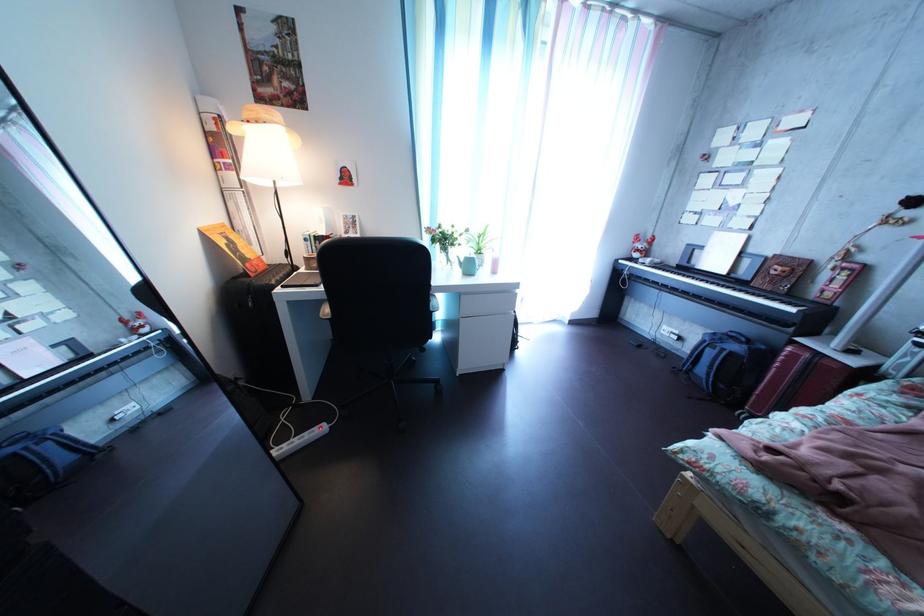
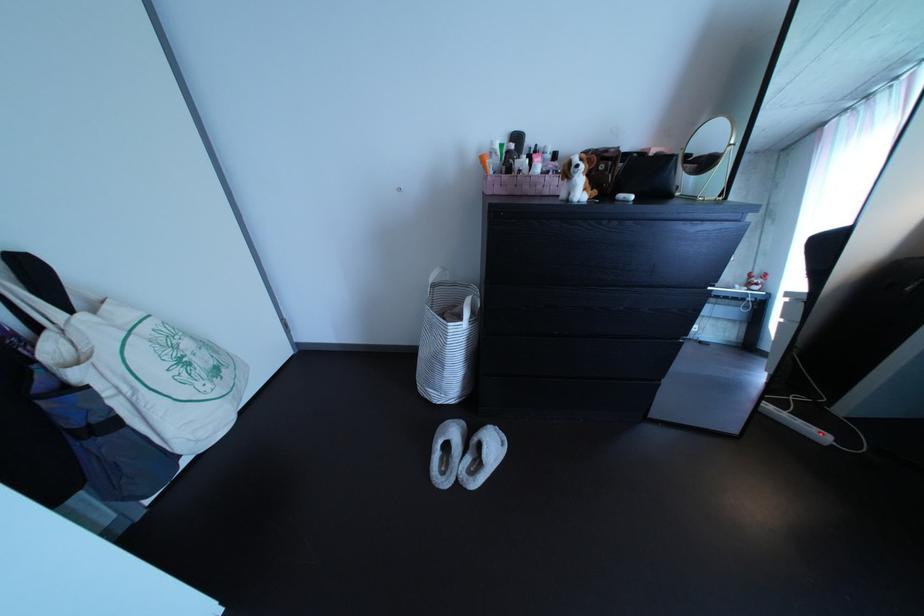
First-person continuous shooting, in which direction is the camera rotating?

The camera's rotation is toward left-down.